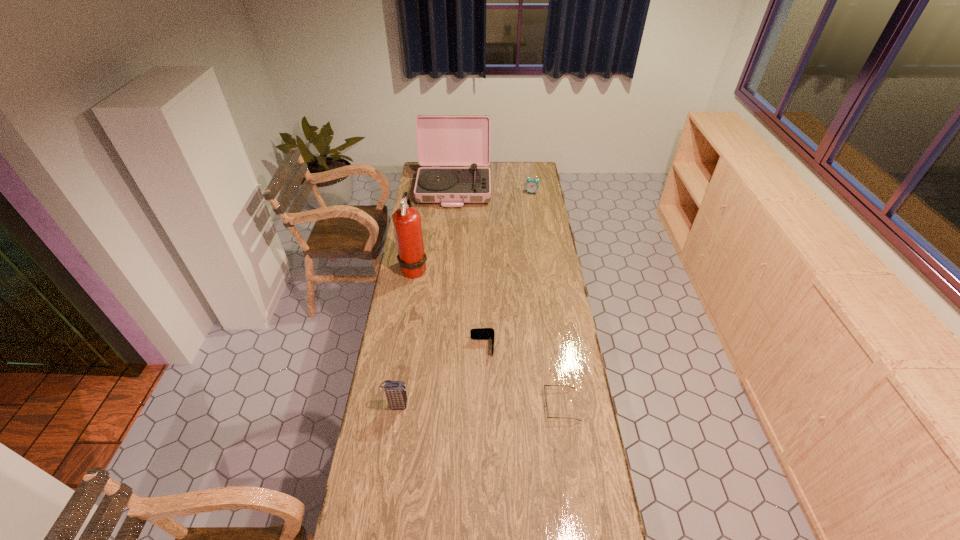
Where is `fire extinguisher`? The width and height of the screenshot is (960, 540). fire extinguisher is located at coordinates (412, 259).

Where is `the tallest object`? This screenshot has height=540, width=960. the tallest object is located at coordinates (412, 259).

In order to click on record player in this screenshot , I will do `click(442, 140)`.

The width and height of the screenshot is (960, 540). In order to click on clutch bag in this screenshot , I will do `click(395, 391)`.

You are a GUI agent. You are given a task and a screenshot of the screen. Output one action in this format:
    pyautogui.click(x=<x>, y=<y>)
    Task: Click on the fourth tallest object
    This screenshot has height=540, width=960.
    Given the screenshot: What is the action you would take?
    pyautogui.click(x=532, y=185)

At what (x,y) coordinates should I click in order to perform the action: click on the third nearest object. Please return your answer as a coordinate pair (x, y). The height and width of the screenshot is (540, 960). Looking at the image, I should click on (480, 333).

The height and width of the screenshot is (540, 960). I want to click on wallet, so click(x=480, y=333).

This screenshot has height=540, width=960. Identify the location of the shortest object. (544, 385).

This screenshot has height=540, width=960. What are the coordinates of `vacant space located 0.340m at the nozzle of the tallest object` in the screenshot? It's located at (499, 268).

Where is `vacant region located with the lid open on the second tallest object`? The height and width of the screenshot is (540, 960). vacant region located with the lid open on the second tallest object is located at coordinates (452, 214).